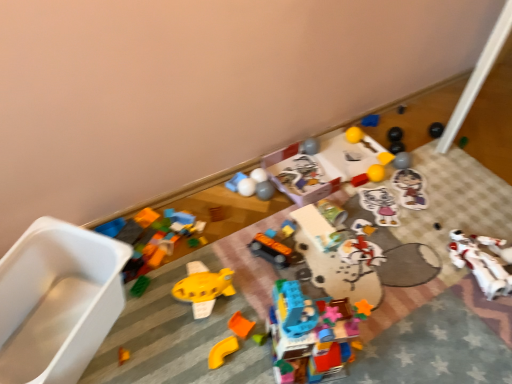
Find the location of a particular element. The width and height of the screenshot is (512, 384). empty space that is in between matte white plush cat at center, marked as the fifth toy in a right-to-left arrangement, and translucent plastic building blocks at center, the 9th toy positioned from the left is located at coordinates (352, 263).